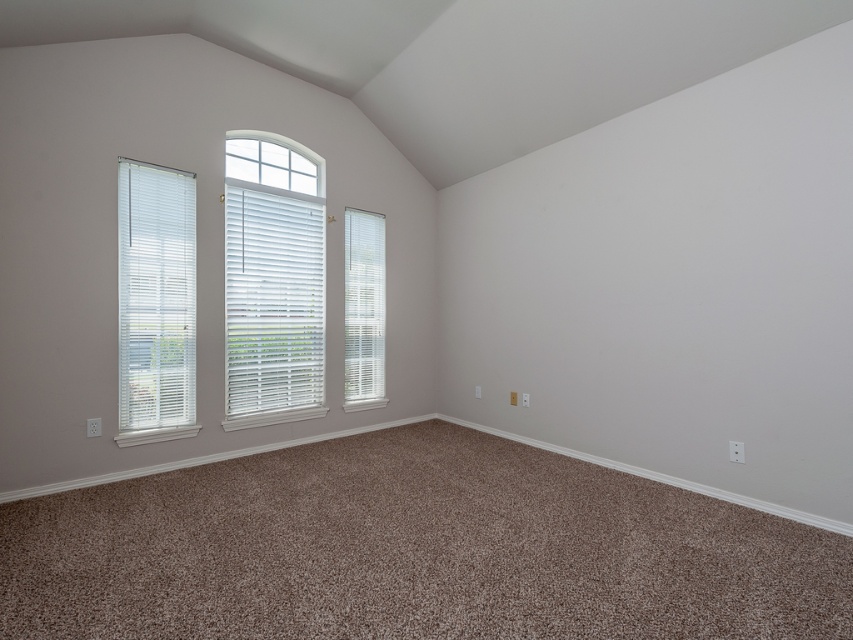
Consider the image. You are standing in the room and want to move from the point at coordinates point (155, 244) to the point at coordinates point (350, 284). Which direction should you move to get closer to your destination?

You should move downward and to the right because point (350, 284) is located below and to the right of point (155, 244).